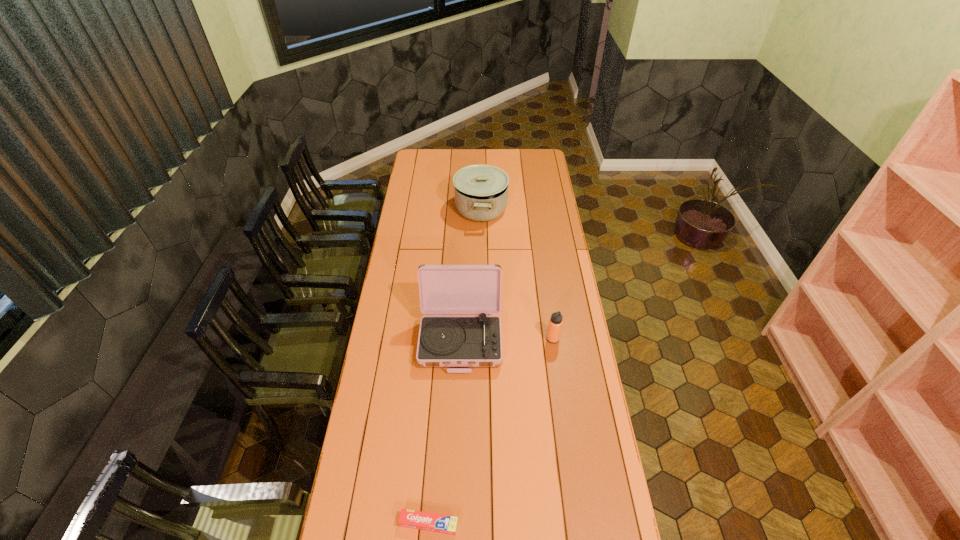
Identify the location of empty space that is in between the shortest object and the record player. The width and height of the screenshot is (960, 540). (444, 431).

Image resolution: width=960 pixels, height=540 pixels. Identify the location of unoccupied area between the third tallest object and the tallest object. (507, 339).

Where is `object that stands as the second closest to the second tallest object`? The height and width of the screenshot is (540, 960). object that stands as the second closest to the second tallest object is located at coordinates (555, 323).

The image size is (960, 540). Identify the location of object identified as the closest to the rightmost object. (446, 341).

The image size is (960, 540). Find the location of `free space that satisfies the following two spatial constraints: 1. on the back side of the nearest object; 2. on the right side of the saucepan`. free space that satisfies the following two spatial constraints: 1. on the back side of the nearest object; 2. on the right side of the saucepan is located at coordinates (452, 208).